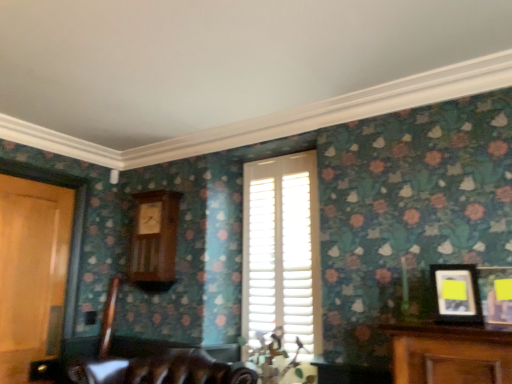
What do you see at coordinates (32, 272) in the screenshot? The width and height of the screenshot is (512, 384). I see `wooden door at left` at bounding box center [32, 272].

Where is `matte black picture frame at right, the second picture frame from the right`? Image resolution: width=512 pixels, height=384 pixels. matte black picture frame at right, the second picture frame from the right is located at coordinates (456, 294).

What do you see at coordinates (497, 293) in the screenshot? I see `yellow matte picture frame at right, the second picture frame viewed from the left` at bounding box center [497, 293].

Locate an element on the screen. wooden clock at center-left is located at coordinates (154, 241).

Is yellow matte picture frame at right, the second picture frame viewed from the left, at the back of white wooden shutters at center?

No, white wooden shutters at center is not facing away from yellow matte picture frame at right, the second picture frame viewed from the left.

From the image's perspective, which object appears higher, white wooden shutters at center or yellow matte picture frame at right, positioned as the 1th picture frame in right-to-left order?

yellow matte picture frame at right, positioned as the 1th picture frame in right-to-left order, from the image's perspective.

Is point (264, 258) behind point (482, 284)?

Yes.

Based on the photo, from the image's perspective, is wooden clock at center-left above matte black picture frame at right, the first picture frame positioned from the left?

Correct, wooden clock at center-left appears higher than matte black picture frame at right, the first picture frame positioned from the left, in the image.

Can you tell me how much wooden clock at center-left and matte black picture frame at right, the first picture frame positioned from the left, differ in facing direction?

14.7 degrees separate the facing orientations of wooden clock at center-left and matte black picture frame at right, the first picture frame positioned from the left.

Between wooden clock at center-left and matte black picture frame at right, the first picture frame positioned from the left, which one has less height?

matte black picture frame at right, the first picture frame positioned from the left.

Is wooden clock at center-left wider than matte black picture frame at right, the first picture frame positioned from the left?

Yes, wooden clock at center-left is wider than matte black picture frame at right, the first picture frame positioned from the left.

Looking at this image, from a real-world perspective, is wooden door at left positioned over matte black picture frame at right, the second picture frame from the right, based on gravity?

Indeed, from a real-world perspective, wooden door at left stands above matte black picture frame at right, the second picture frame from the right.

Is wooden door at left in front of matte black picture frame at right, the first picture frame positioned from the left?

No, wooden door at left is behind matte black picture frame at right, the first picture frame positioned from the left.

Is wooden door at left far away from matte black picture frame at right, the first picture frame positioned from the left?

Absolutely, wooden door at left is distant from matte black picture frame at right, the first picture frame positioned from the left.

You are a GUI agent. You are given a task and a screenshot of the screen. Output one action in this format:
    pyautogui.click(x=<x>, y=<y>)
    Task: Click on the picture frame in front of the matte black picture frame at right, the first picture frame positioned from the left
    This screenshot has width=512, height=384.
    Given the screenshot: What is the action you would take?
    pyautogui.click(x=497, y=293)

From a real-world perspective, is matte black picture frame at right, the first picture frame positioned from the left, on top of yellow matte picture frame at right, the second picture frame viewed from the left?

No, from a real-world perspective, matte black picture frame at right, the first picture frame positioned from the left, is not on top of yellow matte picture frame at right, the second picture frame viewed from the left.

Is matte black picture frame at right, the second picture frame from the right, to the left or to the right of yellow matte picture frame at right, positioned as the 1th picture frame in right-to-left order, in the image?

In the image, matte black picture frame at right, the second picture frame from the right, appears on the left side of yellow matte picture frame at right, positioned as the 1th picture frame in right-to-left order.

Are matte black picture frame at right, the second picture frame from the right, and yellow matte picture frame at right, positioned as the 1th picture frame in right-to-left order, beside each other?

Yes, matte black picture frame at right, the second picture frame from the right, and yellow matte picture frame at right, positioned as the 1th picture frame in right-to-left order, clearly make contact.

The height and width of the screenshot is (384, 512). In order to click on window lying behind the yellow matte picture frame at right, positioned as the 1th picture frame in right-to-left order in this screenshot , I will do `click(282, 251)`.

Can you confirm if yellow matte picture frame at right, positioned as the 1th picture frame in right-to-left order, is thinner than white wooden shutters at center?

Incorrect, the width of yellow matte picture frame at right, positioned as the 1th picture frame in right-to-left order, is not less than that of white wooden shutters at center.

From a real-world perspective, who is located lower, yellow matte picture frame at right, the second picture frame viewed from the left, or white wooden shutters at center?

yellow matte picture frame at right, the second picture frame viewed from the left, is physically lower.

Do you think yellow matte picture frame at right, positioned as the 1th picture frame in right-to-left order, is within white wooden shutters at center, or outside of it?

yellow matte picture frame at right, positioned as the 1th picture frame in right-to-left order, is outside white wooden shutters at center.

Can you confirm if wooden door at left is bigger than yellow matte picture frame at right, positioned as the 1th picture frame in right-to-left order?

Correct, wooden door at left is larger in size than yellow matte picture frame at right, positioned as the 1th picture frame in right-to-left order.

Is wooden door at left further to camera compared to yellow matte picture frame at right, the second picture frame viewed from the left?

Yes.

Looking at this image, from the image's perspective, is wooden door at left beneath yellow matte picture frame at right, positioned as the 1th picture frame in right-to-left order?

Yes, from the image's perspective, wooden door at left is beneath yellow matte picture frame at right, positioned as the 1th picture frame in right-to-left order.

Would you consider wooden door at left to be distant from yellow matte picture frame at right, the second picture frame viewed from the left?

Indeed, wooden door at left is not near yellow matte picture frame at right, the second picture frame viewed from the left.

Is yellow matte picture frame at right, the second picture frame viewed from the left, to the left of wooden clock at center-left from the viewer's perspective?

No.

Considering the sizes of objects yellow matte picture frame at right, the second picture frame viewed from the left, and wooden clock at center-left in the image provided, who is thinner, yellow matte picture frame at right, the second picture frame viewed from the left, or wooden clock at center-left?

yellow matte picture frame at right, the second picture frame viewed from the left, is thinner.

Between yellow matte picture frame at right, the second picture frame viewed from the left, and wooden clock at center-left, which one is positioned behind?

wooden clock at center-left is further from the camera.

What's the angular difference between yellow matte picture frame at right, the second picture frame viewed from the left, and wooden clock at center-left's facing directions?

The angle between the facing direction of yellow matte picture frame at right, the second picture frame viewed from the left, and the facing direction of wooden clock at center-left is 5.83 degrees.

Identify the location of window behind the yellow matte picture frame at right, positioned as the 1th picture frame in right-to-left order. The image size is (512, 384). (282, 251).

Which picture frame is the 1st one when counting from the right side of the wooden clock at center-left? Please provide its 2D coordinates.

[(456, 294)]

Looking at the image, which one is located closer to white wooden shutters at center, wooden clock at center-left or wooden door at left?

The object closer to white wooden shutters at center is wooden clock at center-left.

Consider the image. Considering their positions, is wooden clock at center-left positioned closer to wooden door at left than yellow matte picture frame at right, the second picture frame viewed from the left?

wooden clock at center-left is closer to wooden door at left.

When comparing their distances from wooden door at left, does yellow matte picture frame at right, the second picture frame viewed from the left, or white wooden shutters at center seem further?

yellow matte picture frame at right, the second picture frame viewed from the left.

From the image, which object appears to be farther from matte black picture frame at right, the second picture frame from the right, white wooden shutters at center or yellow matte picture frame at right, the second picture frame viewed from the left?

white wooden shutters at center is positioned further to the anchor matte black picture frame at right, the second picture frame from the right.

From the image, which object appears to be nearer to white wooden shutters at center, wooden door at left or wooden clock at center-left?

wooden clock at center-left is closer to white wooden shutters at center.

From the image, which object appears to be nearer to wooden clock at center-left, matte black picture frame at right, the second picture frame from the right, or yellow matte picture frame at right, the second picture frame viewed from the left?

matte black picture frame at right, the second picture frame from the right, lies closer to wooden clock at center-left than the other object.

When comparing their distances from matte black picture frame at right, the second picture frame from the right, does wooden clock at center-left or wooden door at left seem further?

wooden door at left lies further to matte black picture frame at right, the second picture frame from the right, than the other object.

Based on their spatial positions, is wooden door at left or wooden clock at center-left closer to yellow matte picture frame at right, the second picture frame viewed from the left?

Based on the image, wooden clock at center-left appears to be nearer to yellow matte picture frame at right, the second picture frame viewed from the left.

Where is `clock situated between wooden door at left and white wooden shutters at center from left to right`? The width and height of the screenshot is (512, 384). clock situated between wooden door at left and white wooden shutters at center from left to right is located at coordinates (154, 241).

Identify the location of clock between wooden door at left and yellow matte picture frame at right, positioned as the 1th picture frame in right-to-left order. This screenshot has height=384, width=512. (154, 241).

Locate an element on the screen. picture frame between wooden clock at center-left and yellow matte picture frame at right, the second picture frame viewed from the left is located at coordinates (456, 294).

At what (x,y) coordinates should I click in order to perform the action: click on picture frame located between yellow matte picture frame at right, the second picture frame viewed from the left, and white wooden shutters at center in the depth direction. Please return your answer as a coordinate pair (x, y). Looking at the image, I should click on (456, 294).